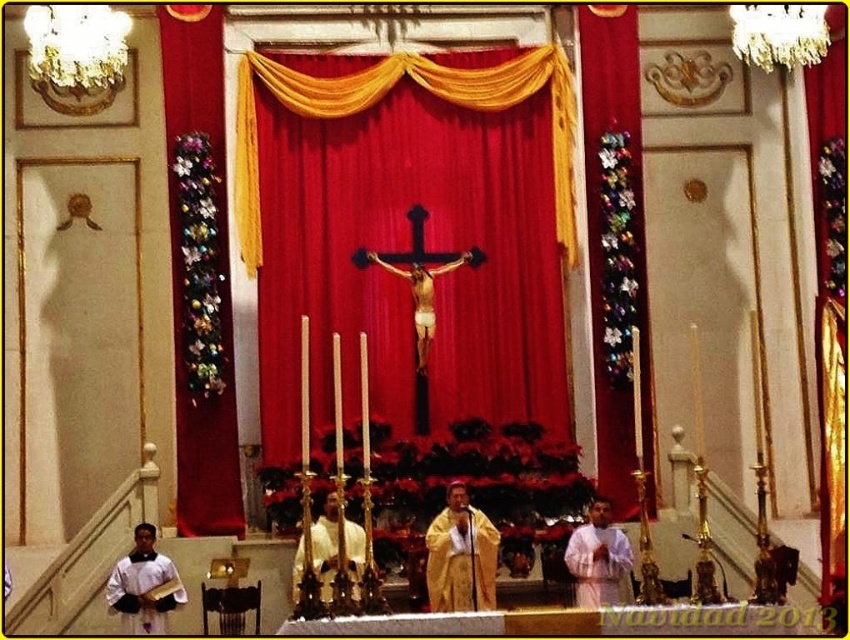
Question: In this image, where is red velvet curtain at center located relative to white clothed figure at center?

Choices:
 (A) above
 (B) below

Answer: (A)

Question: Is shiny metallic tinsel at left bigger than white silk robe at center?

Choices:
 (A) yes
 (B) no

Answer: (A)

Question: Can you confirm if multicolored fabric at right is positioned below red velvet curtain at center?

Choices:
 (A) no
 (B) yes

Answer: (B)

Question: Which object appears farthest from the camera in this image?

Choices:
 (A) wooden crucifix at center
 (B) white matte robe at lower left

Answer: (A)

Question: Based on their relative distances, which object is nearer to the white clothed figure at center?

Choices:
 (A) golden silk robe at center
 (B) shiny metallic tinsel at left
 (C) red velvet curtain at center
 (D) wooden crucifix at center

Answer: (A)

Question: Which point is closer to the camera taking this photo?

Choices:
 (A) (160, 604)
 (B) (460, 598)
 (C) (585, 545)

Answer: (B)